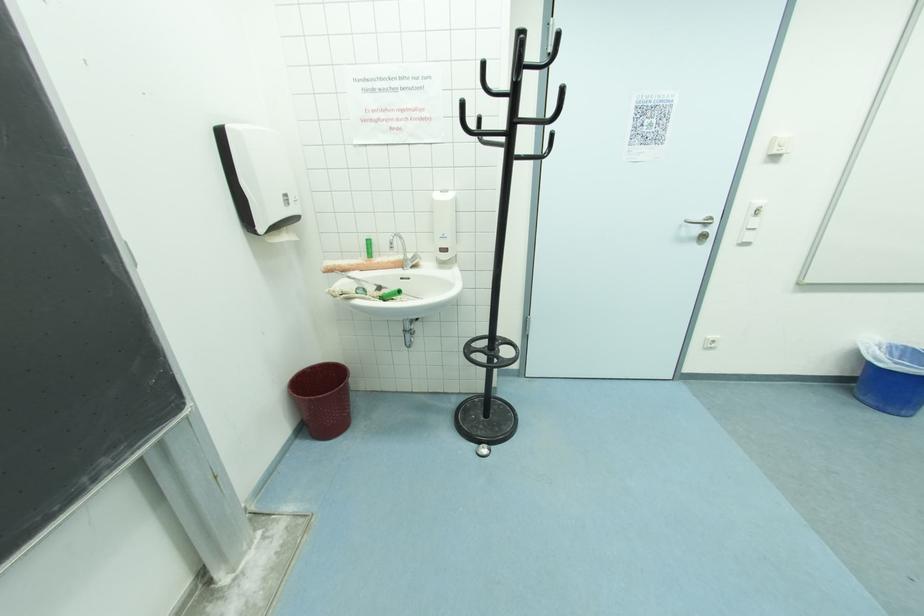
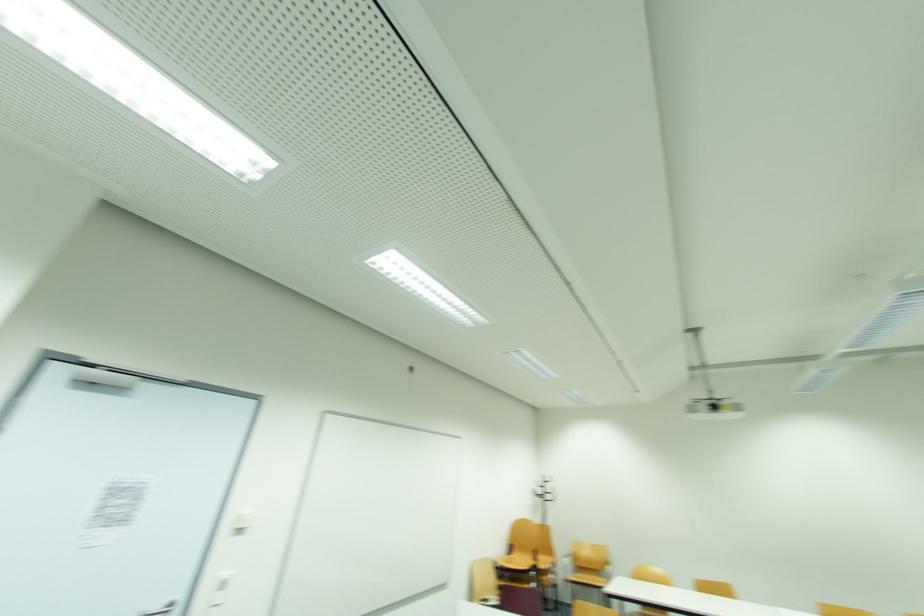
First-person continuous shooting, in which direction is the camera rotating?

The rotation direction of the camera is right-up.